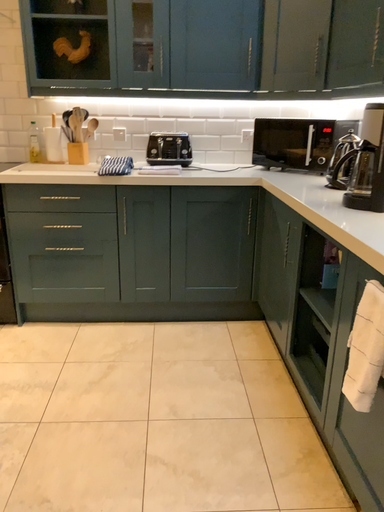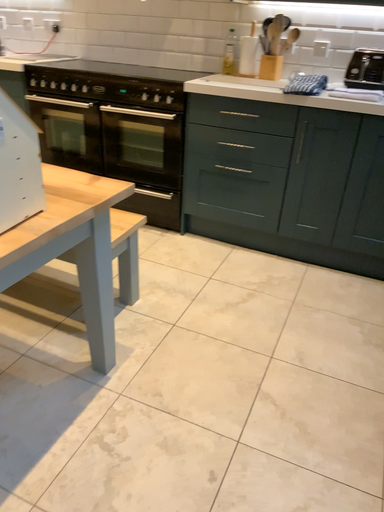
Question: Which way did the camera rotate in the video?

Choices:
 (A) rotated left
 (B) rotated right

Answer: (A)